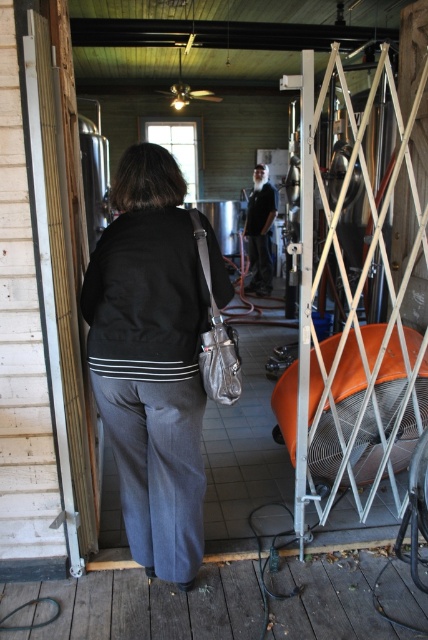
You are an interior designer planning to install a new coat rack in this brewery space. The wooden screen door at left and the black leather jacket at center are both in your line of sight. Which object is smaller and would require less space for the coat rack placement?

The wooden screen door at left is smaller than the black leather jacket at center, so it would require less space for the coat rack placement.

You are standing in a brewery and want to exit through the wooden screen door at left. The matte black jacket at center is blocking your path. Can you walk around it to reach the door?

The matte black jacket at center is further to the viewer than the wooden screen door at left, so you can walk around it to reach the door.

You are a visitor entering the brewery and see the wooden screen door at left and the black leather jacket at center. Which object is closer to the entrance of the space?

The wooden screen door at left is closer to the entrance of the space because it is positioned to the left of the black leather jacket at center, which is further inward.